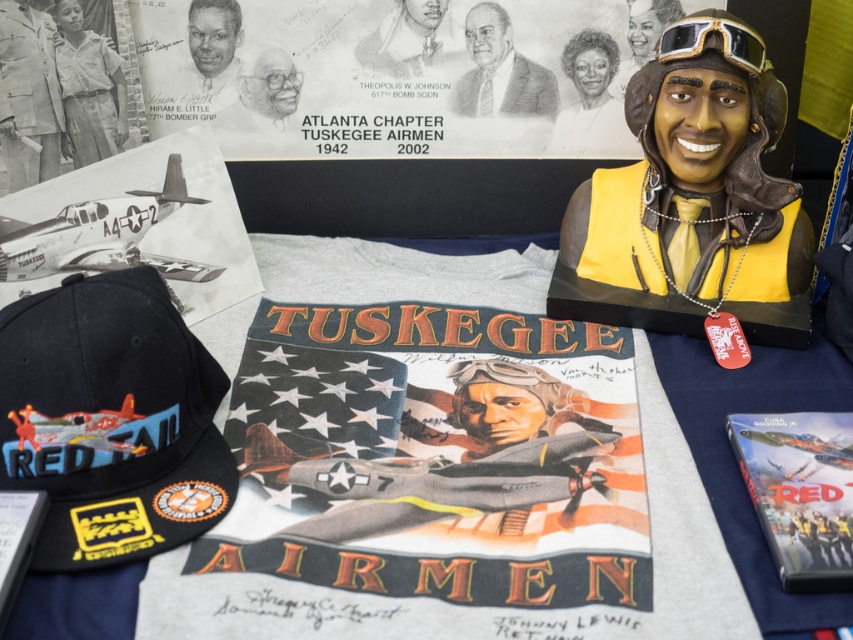
You are a visitor at a museum exhibit about the Tuskegee Airmen. You see a matte yellow wax bust at right and a smooth black portrait at upper left. Which object is positioned lower on the display table?

The matte yellow wax bust at right is located below the smooth black portrait at upper left, so it is positioned lower on the display table.

Where is the smooth skin portrait at upper center located in terms of coordinates?

The smooth skin portrait at upper center is located at coordinates point (x=590, y=100).

You are a photographer standing in front of the display table. You want to take a photo that includes both the tshirt with bold red and yellow lettering and the black baseball cap with a colorful patch. Which object should you focus on first to ensure both are in focus? The tshirt with bold red and yellow lettering is located at point (564,147) and the black baseball cap with a colorful patch is at point (186,76).

You should focus on the tshirt with bold red and yellow lettering at point (564,147) first because it is closer to the camera than the black baseball cap with a colorful patch at point (186,76). This ensures both objects are within the depth of field.